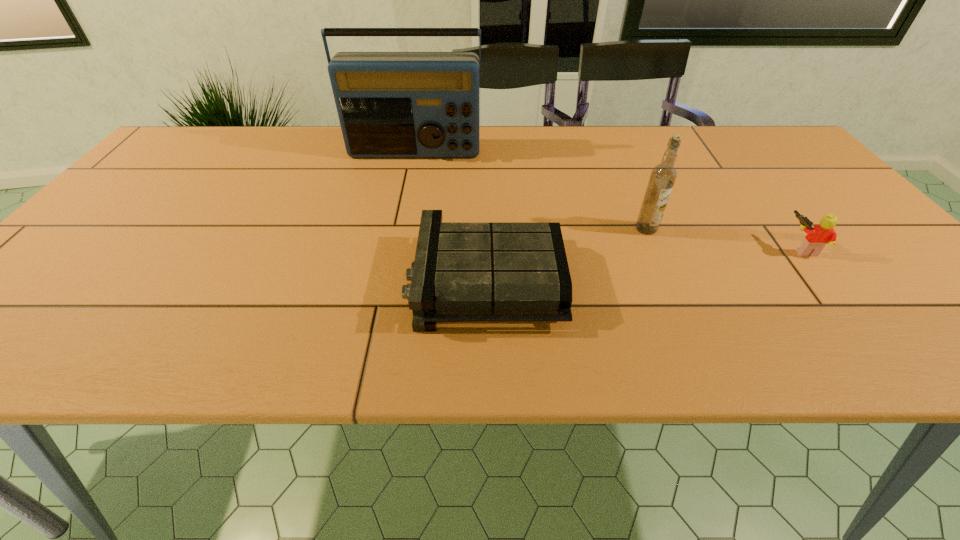
In the image, there is a desktop. Identify the location of free space at the near edge. This screenshot has width=960, height=540. (104, 334).

The width and height of the screenshot is (960, 540). In order to click on vacant region at the left edge of the desktop in this screenshot , I will do `click(52, 308)`.

In the image, there is a desktop. Identify the location of vacant area at the far left corner. The width and height of the screenshot is (960, 540). (173, 163).

What are the coordinates of `vacant area that lies between the farthest object and the rightmost object` in the screenshot? It's located at [x=608, y=201].

Identify the location of empty space that is in between the farthest object and the second object from right to left. (530, 191).

The width and height of the screenshot is (960, 540). Identify the location of free point between the shorter radio receiver and the vodka. (566, 255).

Image resolution: width=960 pixels, height=540 pixels. Identify the location of empty location between the rightmost object and the farther radio receiver. pos(608,201).

In order to click on free space that is in between the shorter radio receiver and the third tallest object in this screenshot , I will do `click(643, 265)`.

Image resolution: width=960 pixels, height=540 pixels. I want to click on free space between the tallest object and the shorter radio receiver, so click(x=450, y=217).

Find the location of a particular element. This screenshot has height=540, width=960. empty location between the tallest object and the rightmost object is located at coordinates (608, 201).